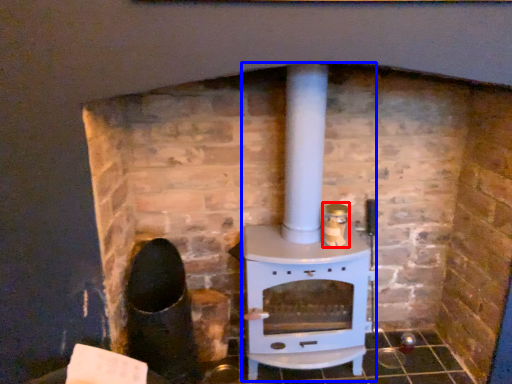
Question: Which of the following is the closest to the observer, appliance (highlighted by a red box) or wood burning stove (highlighted by a blue box)?

Choices:
 (A) appliance
 (B) wood burning stove

Answer: (B)